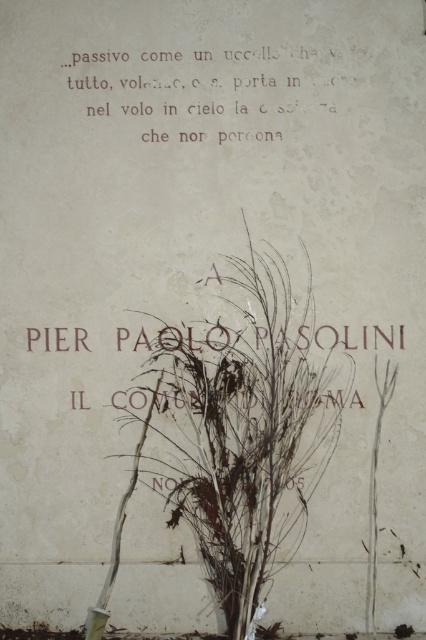
Question: Does brown dried plant at center have a lesser width compared to matte white text at upper center?

Choices:
 (A) yes
 (B) no

Answer: (A)

Question: Does brown dried plant at center have a smaller size compared to matte white text at upper center?

Choices:
 (A) no
 (B) yes

Answer: (A)

Question: Which point is closer to the camera taking this photo?

Choices:
 (A) (201, 404)
 (B) (215, 97)

Answer: (A)

Question: Can you confirm if brown dried plant at center is thinner than matte white text at upper center?

Choices:
 (A) yes
 (B) no

Answer: (A)